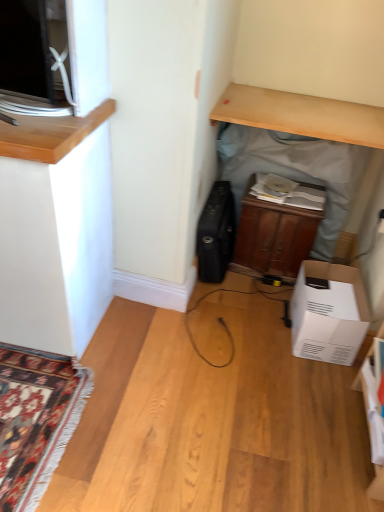
Question: Is light wood desk at upper center at the back of wooden cabinet at center?

Choices:
 (A) yes
 (B) no

Answer: (B)

Question: Can you confirm if wooden cabinet at center is taller than light wood desk at upper center?

Choices:
 (A) no
 (B) yes

Answer: (B)

Question: Is wooden cabinet at center closer to the viewer compared to light wood desk at upper center?

Choices:
 (A) yes
 (B) no

Answer: (B)

Question: From the image's perspective, would you say wooden cabinet at center is positioned over light wood desk at upper center?

Choices:
 (A) no
 (B) yes

Answer: (A)

Question: Can you confirm if wooden cabinet at center is shorter than light wood desk at upper center?

Choices:
 (A) yes
 (B) no

Answer: (B)

Question: Is wooden cabinet at center bigger than light wood desk at upper center?

Choices:
 (A) no
 (B) yes

Answer: (B)

Question: Considering the relative sizes of black matte suitcase at center and light wood desk at upper center in the image provided, is black matte suitcase at center smaller than light wood desk at upper center?

Choices:
 (A) yes
 (B) no

Answer: (B)

Question: Is black matte suitcase at center positioned far away from light wood desk at upper center?

Choices:
 (A) no
 (B) yes

Answer: (A)

Question: Does black matte suitcase at center have a lesser width compared to light wood desk at upper center?

Choices:
 (A) no
 (B) yes

Answer: (B)

Question: From the image's perspective, is black matte suitcase at center under light wood desk at upper center?

Choices:
 (A) no
 (B) yes

Answer: (B)

Question: Does black matte suitcase at center have a greater height compared to light wood desk at upper center?

Choices:
 (A) yes
 (B) no

Answer: (A)

Question: Does black matte suitcase at center appear on the left side of light wood desk at upper center?

Choices:
 (A) yes
 (B) no

Answer: (A)

Question: From the image's perspective, is white cardboard box at lower right on wooden cabinet at center?

Choices:
 (A) yes
 (B) no

Answer: (B)